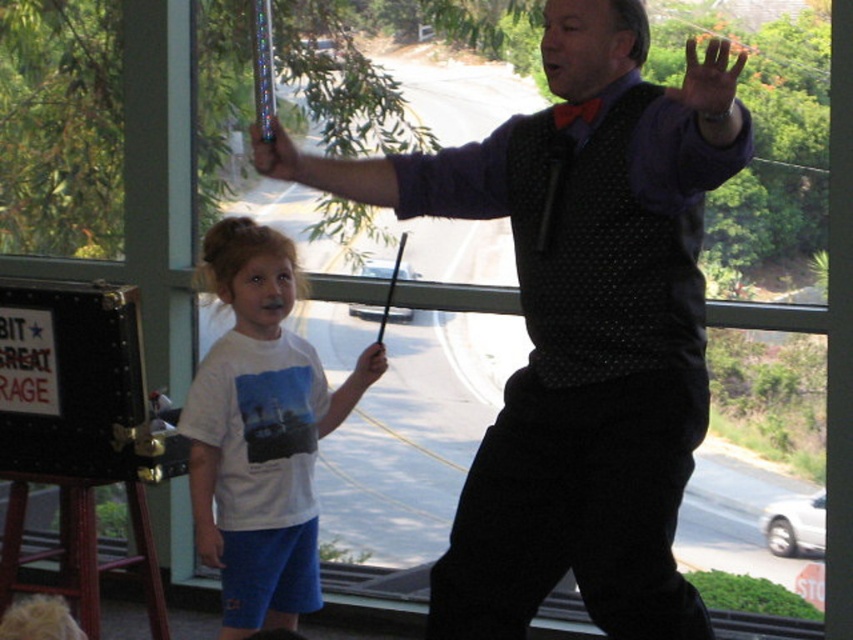
Question: Considering the real-world distances, which object is closest to the smooth skin hand at upper right?

Choices:
 (A) black leather easel at left
 (B) white cotton shirt at center
 (C) metallic wand at upper center

Answer: (C)

Question: Can you confirm if white cotton shirt at center is bigger than black leather easel at left?

Choices:
 (A) no
 (B) yes

Answer: (A)

Question: Which object is positioned closest to the metallic wand at upper center?

Choices:
 (A) black leather easel at left
 (B) polka dot vest at center
 (C) smooth skin hand at upper right

Answer: (B)

Question: Can you confirm if white cotton shirt at center is wider than smooth skin hand at upper right?

Choices:
 (A) no
 (B) yes

Answer: (B)

Question: Which object is positioned closest to the black leather easel at left?

Choices:
 (A) matte black stick at upper center
 (B) smooth skin hand at upper right
 (C) polka dot vest at center

Answer: (A)

Question: Does polka dot vest at center have a greater width compared to white cotton shirt at center?

Choices:
 (A) yes
 (B) no

Answer: (A)